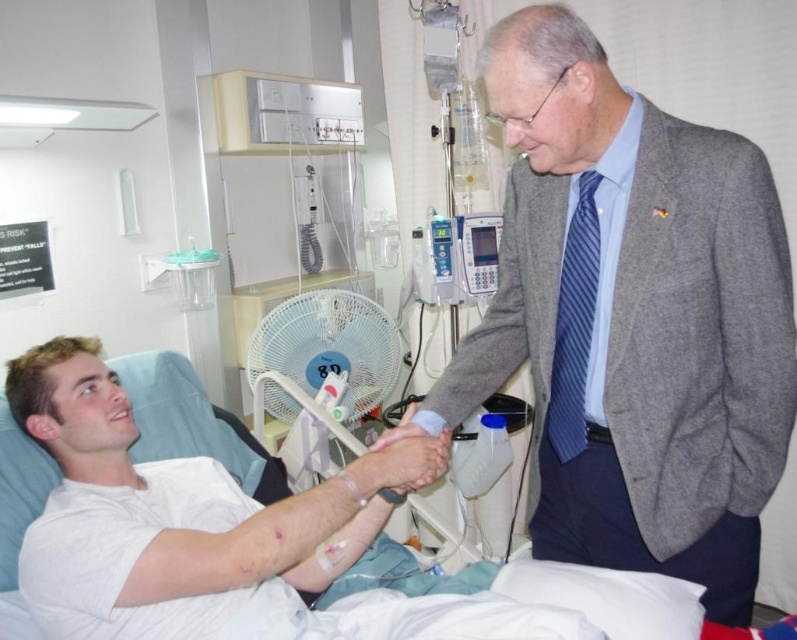
You are a patient in the hospital bed and want to reach a medication bottle located at point (737, 154) and a water bottle at point (402, 422). Which item is closer to you?

The medication bottle located at point (737, 154) is closer to you because it is closer to the camera than the water bottle at point (402, 422).

You are a nurse checking the hospital bed dimensions for a new mattress. The current mattress must fit snugly without gaps. Given that the smooth skin hand at center is an average adult hand size, can you determine if the white fabric hospital bed at center is wide enough for the mattress?

The white fabric hospital bed at center might be wider than smooth skin hand at center, so it is likely wide enough to accommodate the mattress as long as the mattress dimensions align with standard hospital bed sizes.